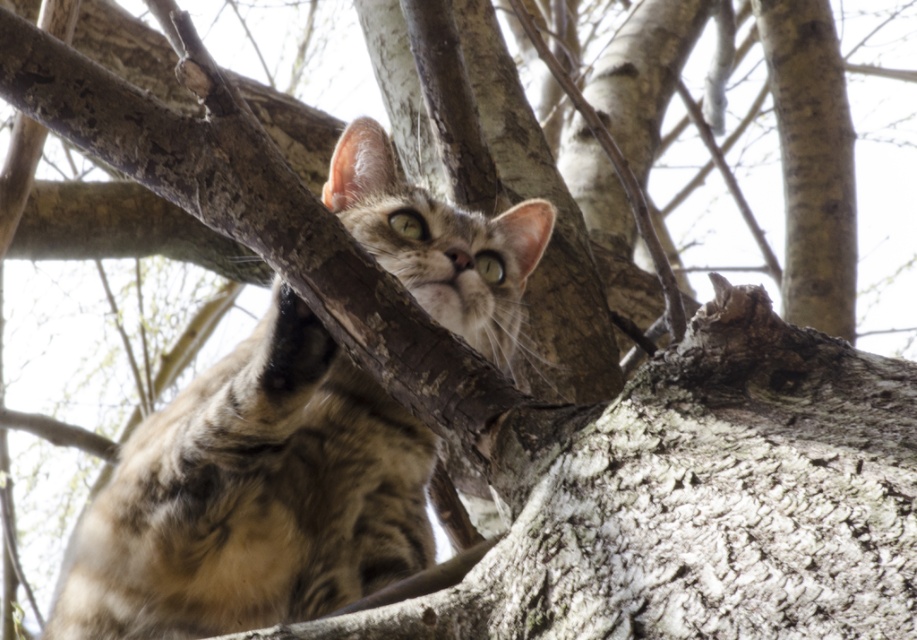
Who is higher up, tabby fur cat at center or smooth gray bark at upper right?

smooth gray bark at upper right is higher up.

Is point (333, 541) in front of point (802, 285)?

Yes.

Who is more distant from viewer, [144,634] or [774,19]?

The point [774,19] is behind.

At what (x,y) coordinates should I click in order to perform the action: click on tabby fur cat at center. Please return your answer as a coordinate pair (x, y). Looking at the image, I should click on (253, 497).